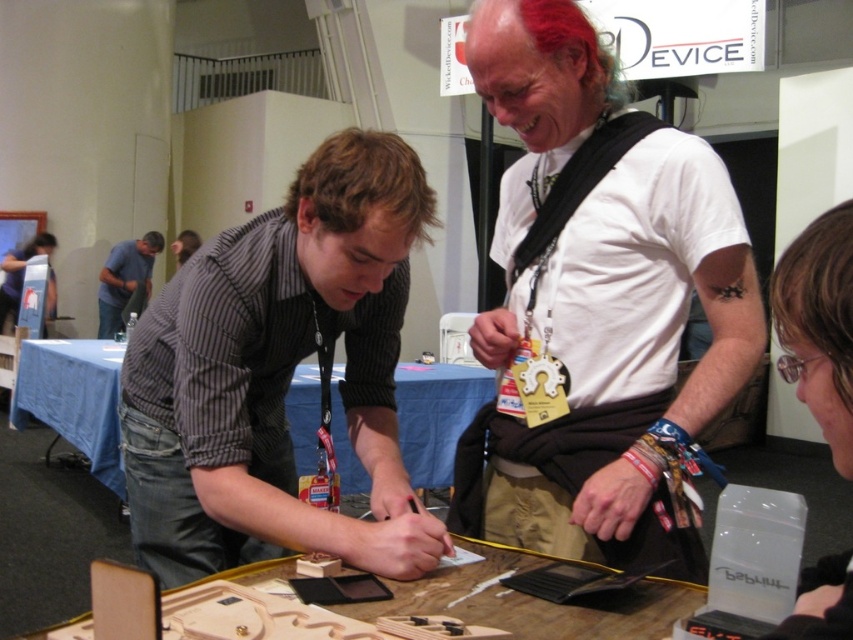
Question: Which point is closer to the camera?

Choices:
 (A) (178, 240)
 (B) (376, 401)

Answer: (B)

Question: Is striped fabric shirt at center to the right of brushed metal water at bottle left from the viewer's perspective?

Choices:
 (A) no
 (B) yes

Answer: (B)

Question: Is wooden at center wider than smooth black shirt at center?

Choices:
 (A) no
 (B) yes

Answer: (B)

Question: Where is white matte shirt at center located in relation to smooth black shirt at center in the image?

Choices:
 (A) below
 (B) above

Answer: (A)

Question: Which of the following is the farthest from the observer?

Choices:
 (A) (82, 376)
 (B) (183, 262)
 (C) (108, 296)
 (D) (277, 564)

Answer: (C)

Question: Among these objects, which one is farthest from the camera?

Choices:
 (A) wooden at center
 (B) brushed metal water at bottle left
 (C) brushed metal shirt at left
 (D) striped fabric shirt at center

Answer: (C)